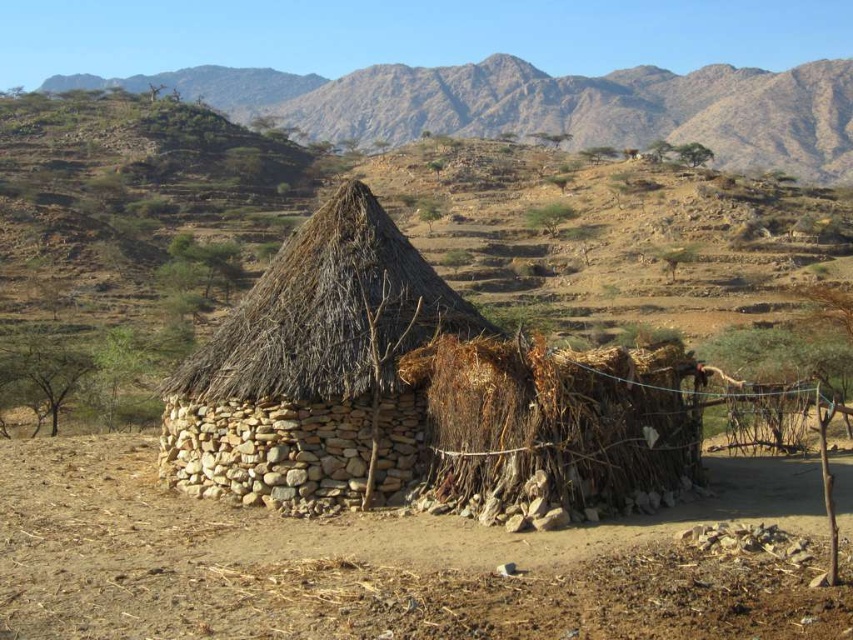
Question: Which of the following is the closest to the observer?

Choices:
 (A) brown soil at center
 (B) brown rocky mountain at upper center

Answer: (A)

Question: Does brown soil at center appear on the left side of thatched straw roof at center?

Choices:
 (A) yes
 (B) no

Answer: (B)

Question: Can you confirm if brown rocky mountain at upper center is positioned above thatched straw roof at center?

Choices:
 (A) no
 (B) yes

Answer: (B)

Question: Can you confirm if brown soil at center is positioned to the left of thatched straw roof at center?

Choices:
 (A) yes
 (B) no

Answer: (B)

Question: Among these points, which one is farthest from the camera?

Choices:
 (A) (428, 120)
 (B) (206, 381)
 (C) (695, 586)

Answer: (A)

Question: Which point is farther to the camera?

Choices:
 (A) thatched straw roof at center
 (B) brown rocky mountain at upper center

Answer: (B)